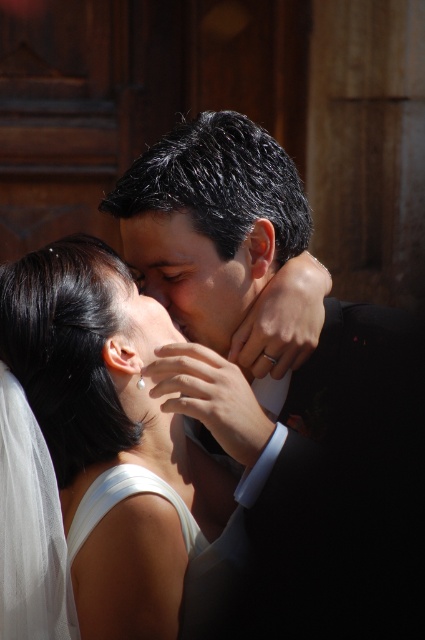
Question: Can you confirm if black satin suit at center is bigger than smooth skin face at center?

Choices:
 (A) no
 (B) yes

Answer: (B)

Question: Which object is farther from the camera taking this photo?

Choices:
 (A) smooth skin face at center
 (B) white satin dress at center
 (C) black satin suit at center

Answer: (A)

Question: Is white satin dress at center positioned at the back of smooth skin face at center?

Choices:
 (A) yes
 (B) no

Answer: (B)

Question: Which object is farther from the camera taking this photo?

Choices:
 (A) smooth skin face at center
 (B) white satin dress at center

Answer: (A)

Question: Can you confirm if black satin suit at center is positioned to the left of smooth skin face at center?

Choices:
 (A) no
 (B) yes

Answer: (A)

Question: Which of the following is the farthest from the observer?

Choices:
 (A) (193, 305)
 (B) (153, 305)
 (C) (207, 426)

Answer: (A)